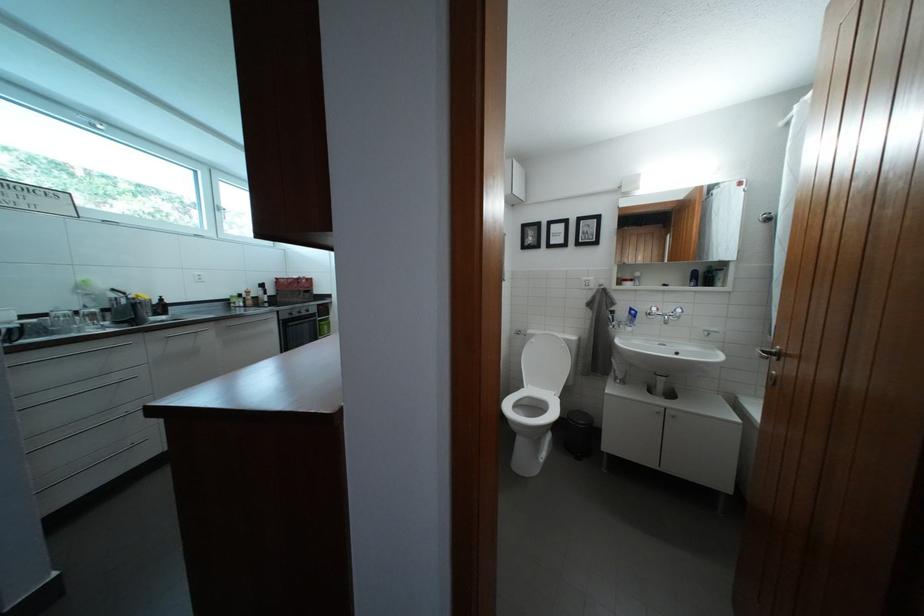
Where is `silver faucet handle`? The image size is (924, 616). silver faucet handle is located at coordinates (709, 331).